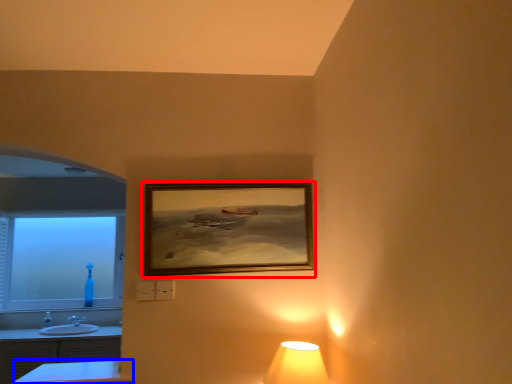
Question: Which object appears closest to the camera in this image, picture frame (highlighted by a red box) or table (highlighted by a blue box)?

Choices:
 (A) picture frame
 (B) table

Answer: (B)